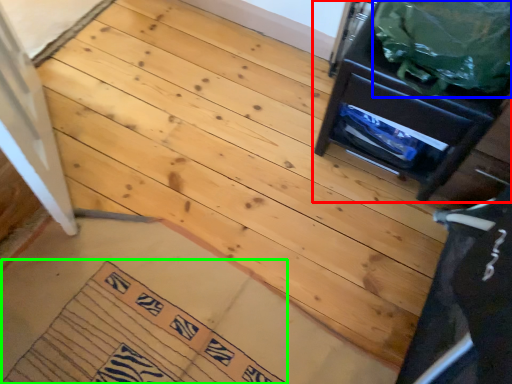
Question: Based on their relative distances, which object is nearer to furniture (highlighted by a red box)? Choose from garbage (highlighted by a blue box) and doormat (highlighted by a green box).

Choices:
 (A) garbage
 (B) doormat

Answer: (A)